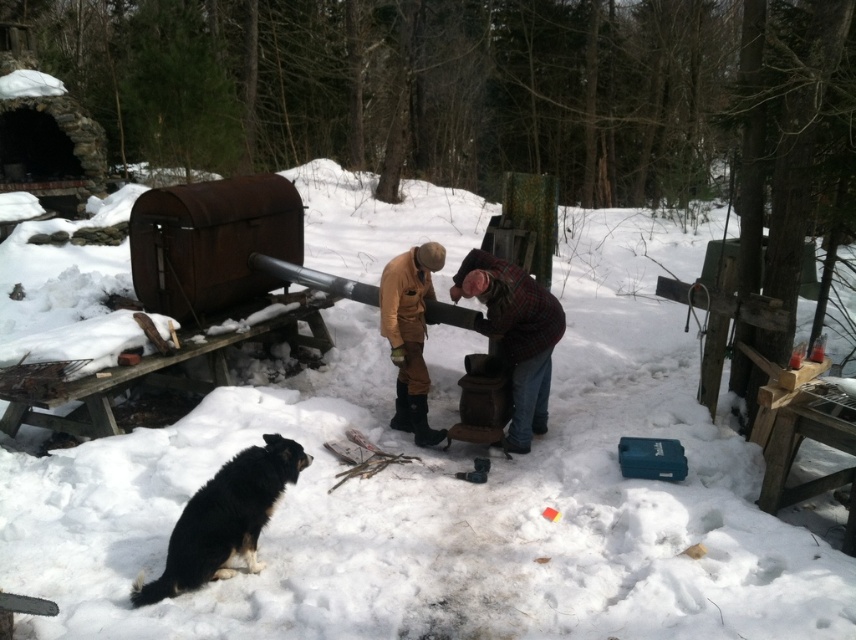
Is black fur dog at lower left thinner than brown suede boots at center?

No, black fur dog at lower left is not thinner than brown suede boots at center.

Is black fur dog at lower left to the left of brown suede boots at center from the viewer's perspective?

Correct, you'll find black fur dog at lower left to the left of brown suede boots at center.

The width and height of the screenshot is (856, 640). I want to click on black fur dog at lower left, so click(224, 518).

Does black fur dog at lower left have a smaller size compared to plaid fabric shirt at center?

Yes, black fur dog at lower left is smaller than plaid fabric shirt at center.

Between black fur dog at lower left and plaid fabric shirt at center, which one appears on the left side from the viewer's perspective?

Positioned to the left is black fur dog at lower left.

Find the location of `black fur dog at lower left`. black fur dog at lower left is located at coordinates (224, 518).

What are the coordinates of `black fur dog at lower left` in the screenshot? It's located at (224, 518).

Does plaid fabric shirt at center appear under brown suede boots at center?

Yes.

Between point (497, 268) and point (407, 387), which one is positioned in front?

Point (497, 268)

Locate an element on the screen. Image resolution: width=856 pixels, height=640 pixels. plaid fabric shirt at center is located at coordinates (515, 336).